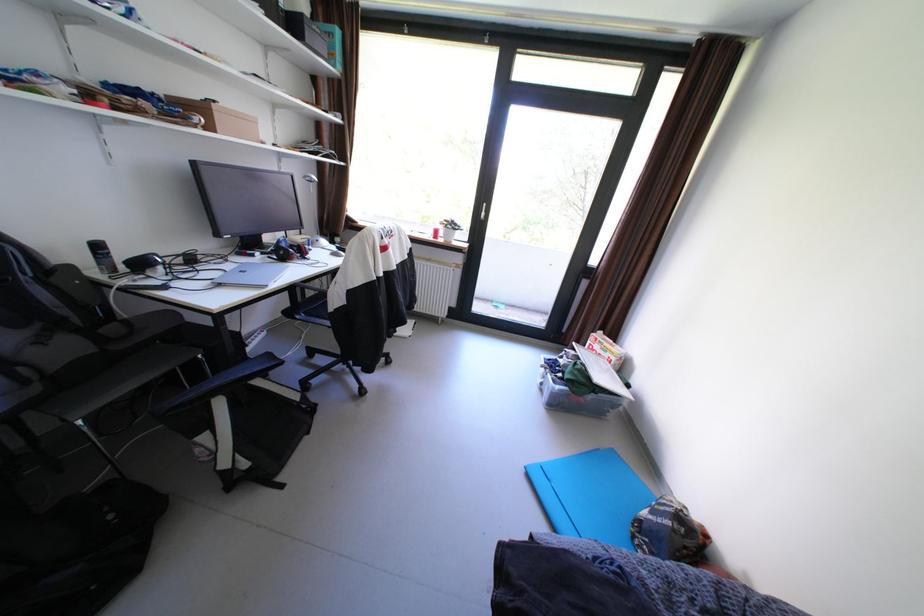
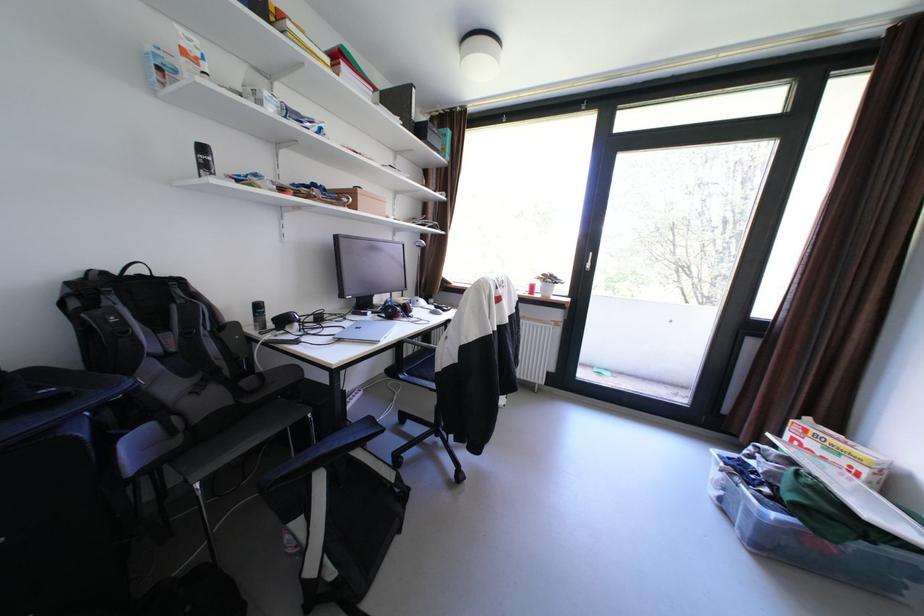
Locate, in the second image, the point that corresponds to (269,254) in the first image.

(380, 313)